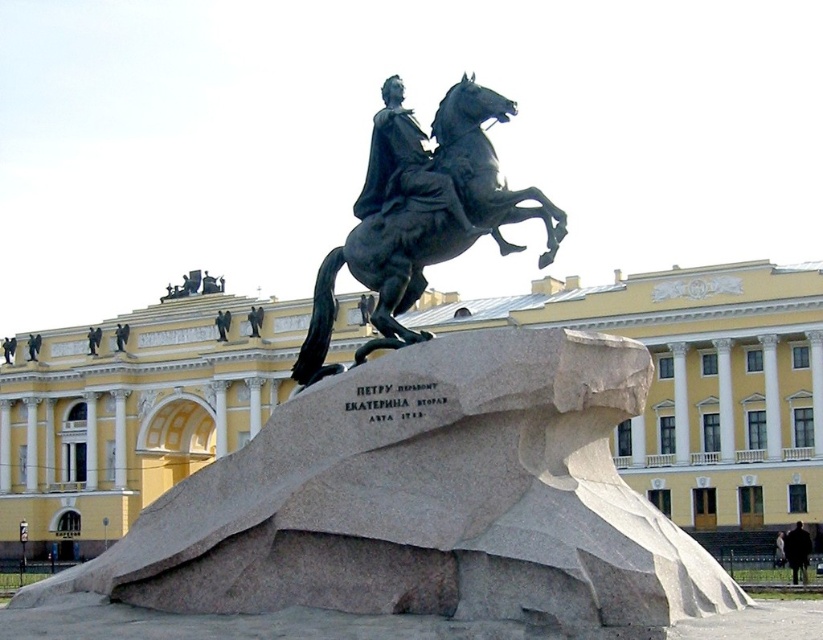
You are standing at the base of the equestrian statue in front of the classical building. You notice two points marked in the image. The first point is at coordinates point (389, 291) and the second is at point (384, 179). If you were to walk directly towards the building, which point would you encounter first?

Point (389, 291) is in front of point (384, 179), so you would encounter point (389, 291) first as you walk towards the building.

You are an art student who wants to measure the distance between the two bronze sculptures in the scene. According to the information provided, how far apart are the polished bronze horse at center and the polished bronze statue at center?

The polished bronze horse at center and the polished bronze statue at center are 6.27 meters apart.